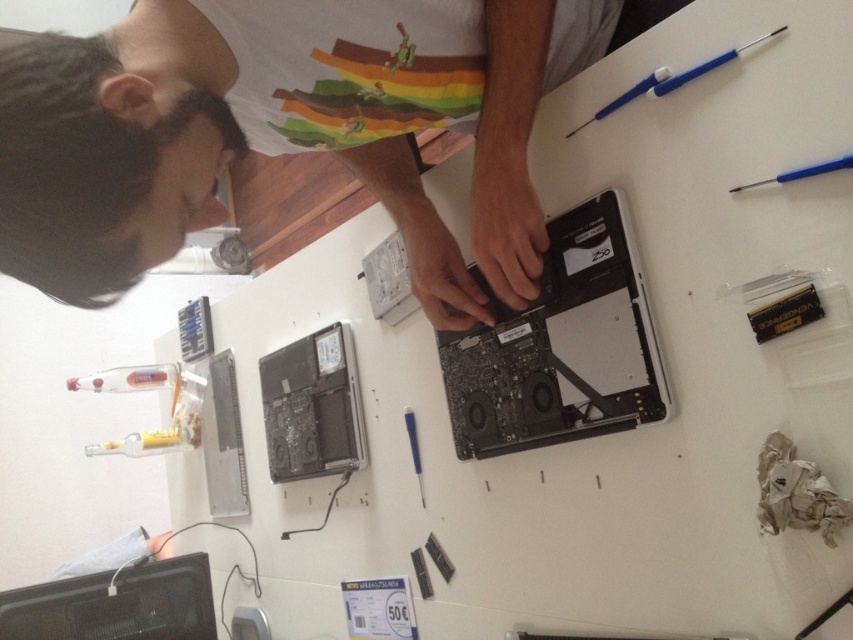
Question: Which point is closer to the camera?

Choices:
 (A) blue plastic pen at upper right
 (B) black plastic computer at center

Answer: (A)

Question: Is white matte shirt at upper center above black plastic computer at center?

Choices:
 (A) yes
 (B) no

Answer: (A)

Question: Does white matte shirt at upper center have a lesser width compared to black plastic computer at center?

Choices:
 (A) yes
 (B) no

Answer: (B)

Question: Which of the following is the farthest from the observer?

Choices:
 (A) white matte shirt at upper center
 (B) blue plastic pen at upper right

Answer: (B)

Question: Which point appears closest to the camera in this image?

Choices:
 (A) (605, 321)
 (B) (68, 51)
 (C) (744, 184)

Answer: (B)

Question: Observing the image, what is the correct spatial positioning of white matte shirt at upper center in reference to blue plastic pen at upper right?

Choices:
 (A) left
 (B) right

Answer: (A)